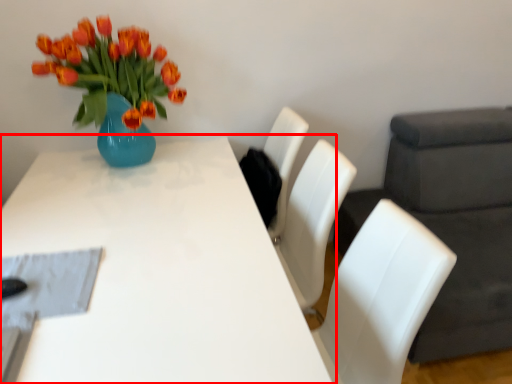
Question: From the image's perspective, where is table (annotated by the red box) located in relation to swivel chair in the image?

Choices:
 (A) above
 (B) below

Answer: (B)